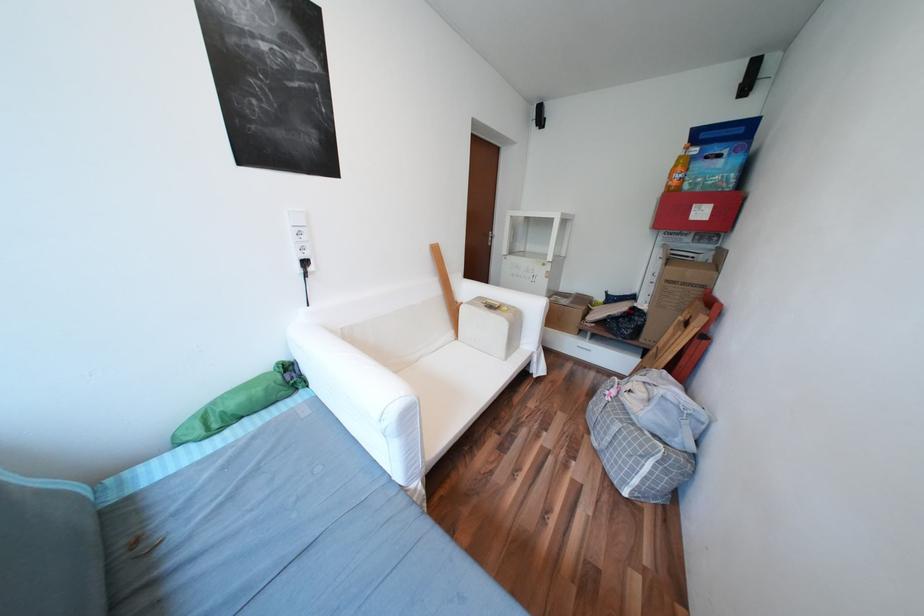
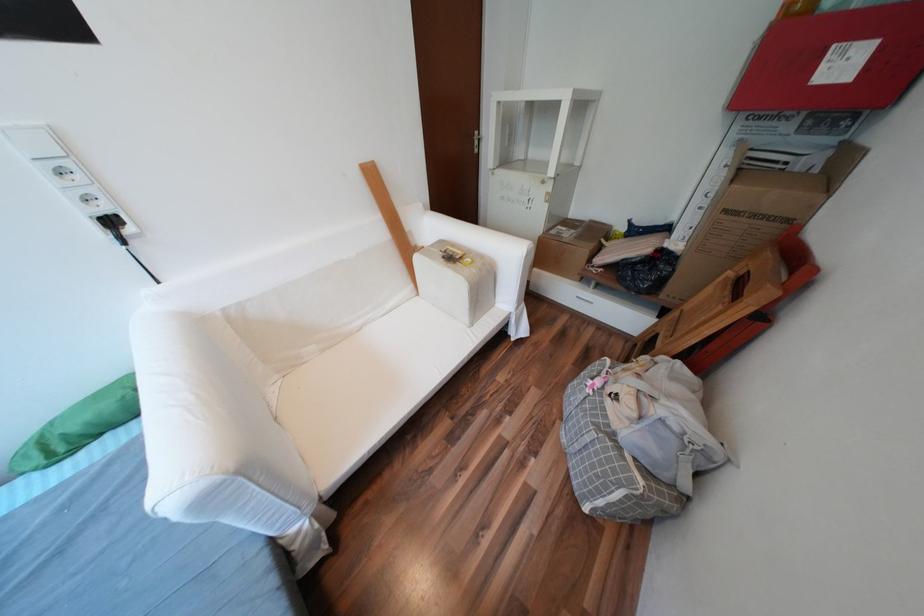
In the second image, find the point that corresponds to [676,281] in the first image.

(736, 211)